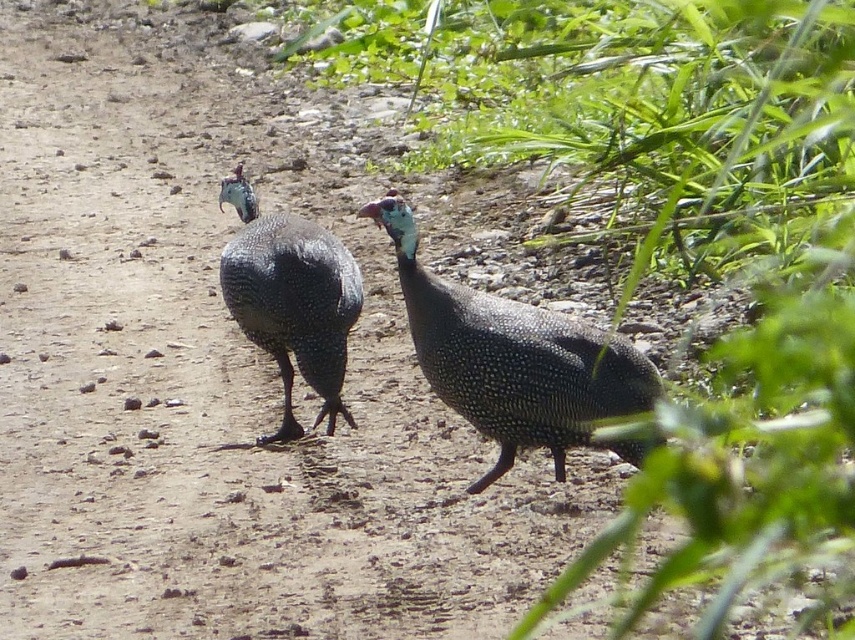
You are a photographer trying to capture both the green leafy plant at center and the satin blue guinea fowl at center in a single frame. Based on their sizes, which one should you focus on to ensure both fit comfortably in the photo?

The green leafy plant at center is wider than the satin blue guinea fowl at center. To ensure both fit comfortably, focus on framing the wider green leafy plant at center first, then adjust the angle to include the guinea fowl.